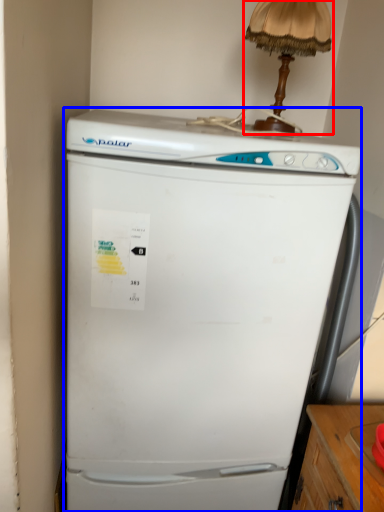
Question: Which object appears farthest to the camera in this image, table lamp (highlighted by a red box) or refrigerator (highlighted by a blue box)?

Choices:
 (A) table lamp
 (B) refrigerator

Answer: (A)